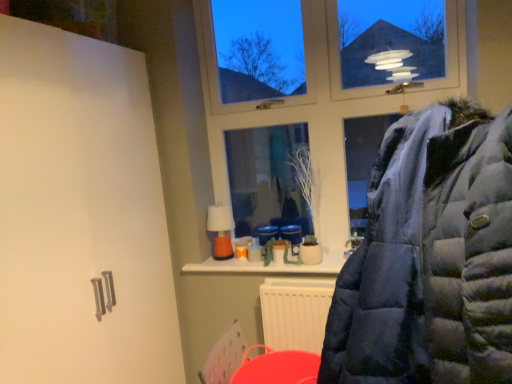
Question: Is dark blue puffer jacket at center turned away from transparent glass window at upper center?

Choices:
 (A) yes
 (B) no

Answer: (A)

Question: Is dark blue puffer jacket at center not close to transparent glass window at upper center?

Choices:
 (A) no
 (B) yes

Answer: (B)

Question: Considering the relative sizes of dark blue puffer jacket at center and transparent glass window at upper center in the image provided, is dark blue puffer jacket at center shorter than transparent glass window at upper center?

Choices:
 (A) yes
 (B) no

Answer: (A)

Question: Are dark blue puffer jacket at center and transparent glass window at upper center beside each other?

Choices:
 (A) no
 (B) yes

Answer: (A)

Question: Does dark blue puffer jacket at center lie in front of transparent glass window at upper center?

Choices:
 (A) no
 (B) yes

Answer: (B)

Question: Visually, is dark blue puffer jacket at center positioned to the left or to the right of rubberized plastic bucket at lower center?

Choices:
 (A) left
 (B) right

Answer: (B)

Question: Considering the positions of dark blue puffer jacket at center and rubberized plastic bucket at lower center in the image, is dark blue puffer jacket at center wider or thinner than rubberized plastic bucket at lower center?

Choices:
 (A) thin
 (B) wide

Answer: (B)

Question: Is dark blue puffer jacket at center inside or outside of rubberized plastic bucket at lower center?

Choices:
 (A) outside
 (B) inside

Answer: (A)

Question: From a real-world perspective, relative to rubberized plastic bucket at lower center, is dark blue puffer jacket at center vertically above or below?

Choices:
 (A) above
 (B) below

Answer: (A)

Question: In terms of size, does transparent glass window at upper center appear bigger or smaller than dark blue puffer jacket at center?

Choices:
 (A) small
 (B) big

Answer: (A)

Question: Is transparent glass window at upper center to the left or to the right of dark blue puffer jacket at center in the image?

Choices:
 (A) right
 (B) left

Answer: (B)

Question: Does point (385, 96) appear closer or farther from the camera than point (482, 329)?

Choices:
 (A) closer
 (B) farther

Answer: (B)

Question: From the image's perspective, is transparent glass window at upper center above or below dark blue puffer jacket at center?

Choices:
 (A) above
 (B) below

Answer: (A)

Question: Considering their positions, is rubberized plastic bucket at lower center located in front of or behind dark blue puffer jacket at center?

Choices:
 (A) behind
 (B) front

Answer: (A)

Question: In terms of width, does rubberized plastic bucket at lower center look wider or thinner when compared to dark blue puffer jacket at center?

Choices:
 (A) thin
 (B) wide

Answer: (A)